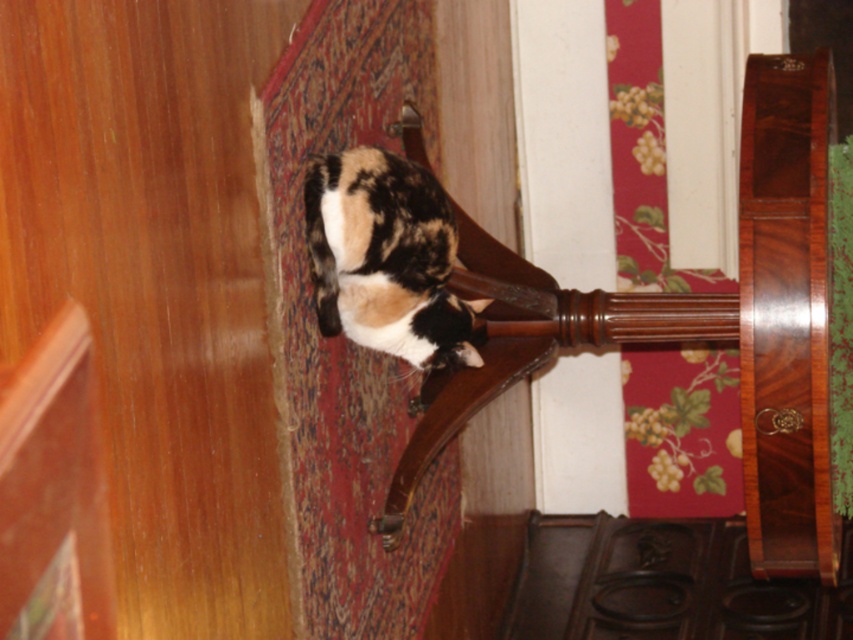
Can you confirm if shiny wood chair at center is wider than calico fur cat at center?

No.

Identify the location of shiny wood chair at center. (733, 312).

Between point (486, 296) and point (315, 288), which one is positioned behind?

Positioned behind is point (486, 296).

What are the coordinates of `shiny wood chair at center` in the screenshot? It's located at (733, 312).